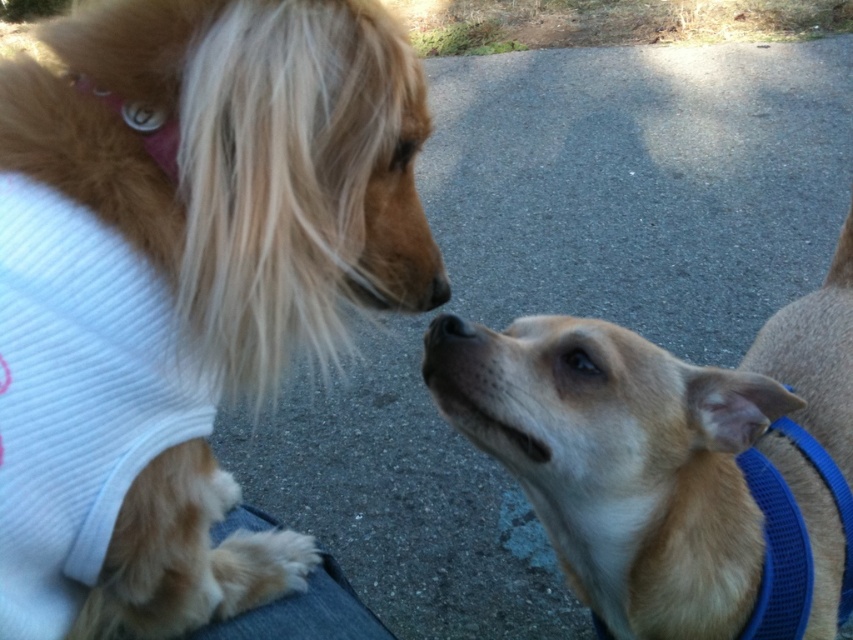
Looking at this image, does soft golden fur at upper left appear on the right side of light brown fur at center?

Incorrect, soft golden fur at upper left is not on the right side of light brown fur at center.

Between soft golden fur at upper left and light brown fur at center, which one is positioned higher?

soft golden fur at upper left

Find the location of `soft golden fur at upper left`. soft golden fur at upper left is located at coordinates (238, 163).